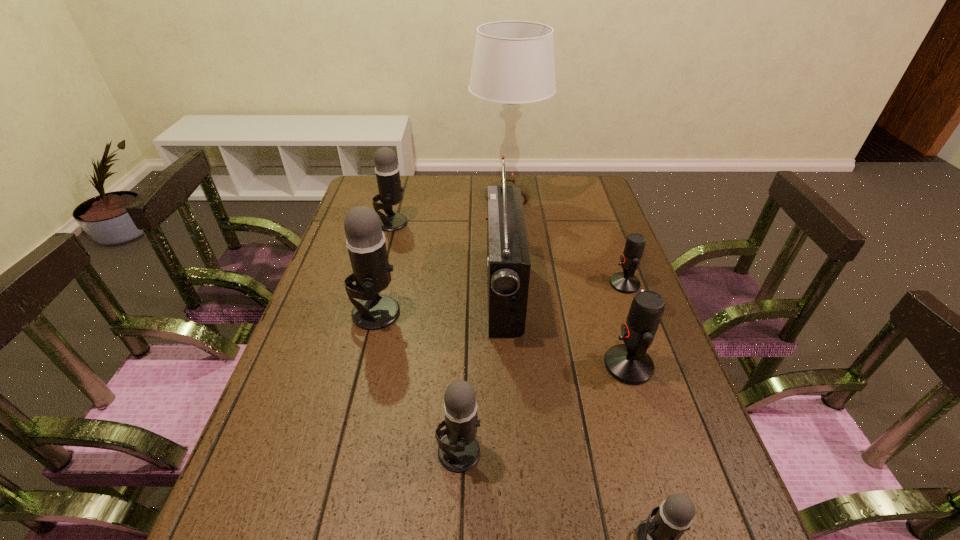
The height and width of the screenshot is (540, 960). I want to click on vacant space at the right edge of the desktop, so click(673, 403).

Where is `free space at the far right corner of the desktop`? The width and height of the screenshot is (960, 540). free space at the far right corner of the desktop is located at coordinates (595, 186).

Identify the location of empty space between the farther red microphone and the radio receiver. (564, 288).

At what (x,y) coordinates should I click in order to perform the action: click on free area in between the radio receiver and the fourth farthest microphone. Please return your answer as a coordinate pair (x, y). Looking at the image, I should click on (565, 328).

Image resolution: width=960 pixels, height=540 pixels. I want to click on free space between the table lamp and the sixth farthest object, so click(x=567, y=282).

Locate an element on the screen. free point between the radio receiver and the fourth microphone from right to left is located at coordinates (481, 372).

Identify which object is the third closest to the sixth farthest object. Please provide its 2D coordinates. Your answer should be formatted as a tuple, i.e. [(x, y)], where the tuple contains the x and y coordinates of a point satisfying the conditions above.

[(657, 539)]

Identify which object is the second nearest to the table lamp. Please provide its 2D coordinates. Your answer should be formatted as a tuple, i.e. [(x, y)], where the tuple contains the x and y coordinates of a point satisfying the conditions above.

[(387, 170)]

Where is `microphone that is the fourth nearest to the fourth microphone from right to left`? microphone that is the fourth nearest to the fourth microphone from right to left is located at coordinates (625, 282).

Image resolution: width=960 pixels, height=540 pixels. I want to click on microphone identified as the second closest to the fifth farthest microphone, so click(x=365, y=242).